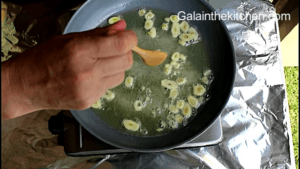
This screenshot has height=169, width=300. In order to click on white wall in this screenshot , I will do `click(293, 37)`.